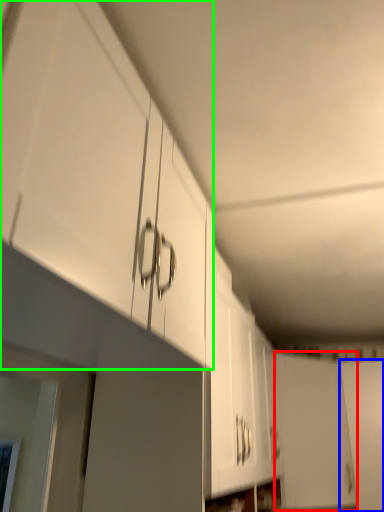
Question: Which is nearer to the door (highlighted by a red box)? door (highlighted by a blue box) or cabinetry (highlighted by a green box).

Choices:
 (A) door
 (B) cabinetry

Answer: (A)